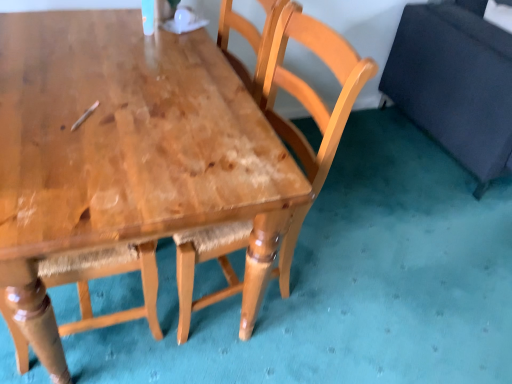
Question: Is shiny brown wood table at center bigger or smaller than wooden chair at center?

Choices:
 (A) small
 (B) big

Answer: (A)

Question: In the image, is shiny brown wood table at center positioned in front of or behind wooden chair at center?

Choices:
 (A) front
 (B) behind

Answer: (A)

Question: Which object is the farthest from the wooden chair at center?

Choices:
 (A) shiny brown wood table at center
 (B) dark blue fabric swivel chair at right

Answer: (B)

Question: Estimate the real-world distances between objects in this image. Which object is farther from the wooden chair at center?

Choices:
 (A) dark blue fabric swivel chair at right
 (B) shiny brown wood table at center

Answer: (A)